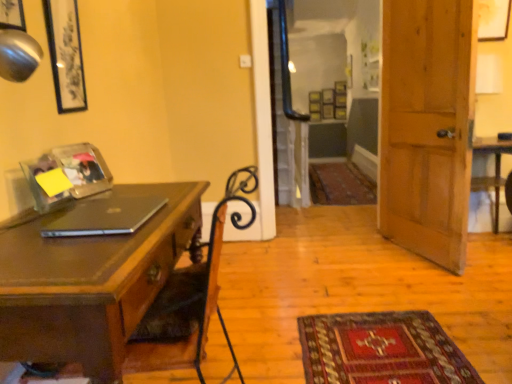
Question: Is wooden picture frame at upper right, arranged as the fifth picture frame when viewed from the left, completely or partially inside clear plastic picture frame at upper left, which appears as the third picture frame when viewed from the front?

Choices:
 (A) yes
 (B) no

Answer: (B)

Question: From the image's perspective, is clear plastic picture frame at upper left, which appears as the third picture frame when viewed from the front, on wooden picture frame at upper right, which ranks as the 5th picture frame in front-to-back order?

Choices:
 (A) yes
 (B) no

Answer: (B)

Question: Is clear plastic picture frame at upper left, which is the third picture frame in back-to-front order, aimed at wooden picture frame at upper right, positioned as the first picture frame in back-to-front order?

Choices:
 (A) yes
 (B) no

Answer: (B)

Question: Is clear plastic picture frame at upper left, which appears as the fourth picture frame when viewed from the left, taller than wooden picture frame at upper right, the first picture frame positioned from the right?

Choices:
 (A) yes
 (B) no

Answer: (B)

Question: Can you confirm if clear plastic picture frame at upper left, which is the third picture frame in back-to-front order, is thinner than wooden picture frame at upper right, arranged as the fifth picture frame when viewed from the left?

Choices:
 (A) no
 (B) yes

Answer: (B)

Question: Based on their sizes in the image, would you say matte black picture frame at upper left, which is the fourth picture frame from front to back, is bigger or smaller than carpeted mat at center?

Choices:
 (A) big
 (B) small

Answer: (B)

Question: Considering the positions of point (75, 102) and point (314, 173), is point (75, 102) closer or farther from the camera than point (314, 173)?

Choices:
 (A) farther
 (B) closer

Answer: (B)

Question: Choose the correct answer: Is matte black picture frame at upper left, which is the fourth picture frame from front to back, inside carpeted mat at center or outside it?

Choices:
 (A) inside
 (B) outside

Answer: (B)

Question: In the image, is matte black picture frame at upper left, which is the fourth picture frame from front to back, on the left side or the right side of carpeted mat at center?

Choices:
 (A) right
 (B) left

Answer: (B)

Question: Is point (42, 211) positioned closer to the camera than point (148, 297)?

Choices:
 (A) farther
 (B) closer

Answer: (A)

Question: From the image's perspective, is clear plastic picture frame at left, marked as the fourth picture frame in a back-to-front arrangement, positioned above or below wooden desk at left?

Choices:
 (A) above
 (B) below

Answer: (A)

Question: In terms of width, does clear plastic picture frame at left, which is the 3th picture frame from left to right, look wider or thinner when compared to wooden desk at left?

Choices:
 (A) thin
 (B) wide

Answer: (A)

Question: From their relative heights in the image, would you say clear plastic picture frame at left, marked as the 3th picture frame in a right-to-left arrangement, is taller or shorter than wooden desk at left?

Choices:
 (A) tall
 (B) short

Answer: (B)

Question: In terms of width, does clear glass screen door at upper center look wider or thinner when compared to wooden door at right?

Choices:
 (A) wide
 (B) thin

Answer: (A)

Question: In terms of size, does clear glass screen door at upper center appear bigger or smaller than wooden door at right?

Choices:
 (A) small
 (B) big

Answer: (B)